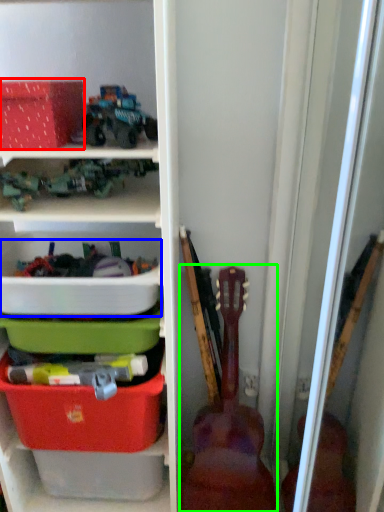
Question: Considering the real-world distances, which object is farthest from storage box (highlighted by a red box)? storage box (highlighted by a blue box) or guitar (highlighted by a green box)?

Choices:
 (A) storage box
 (B) guitar

Answer: (B)